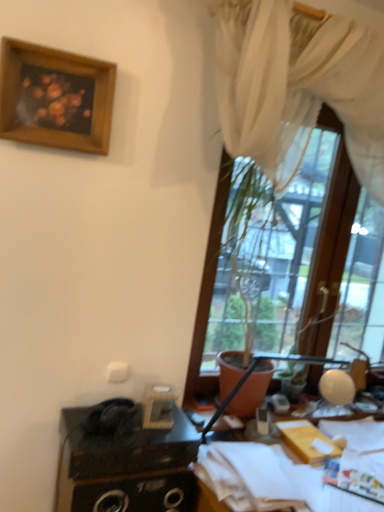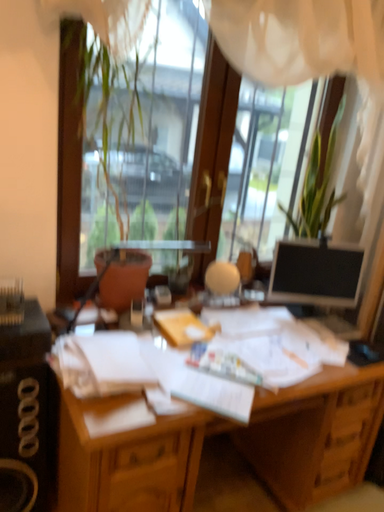
Question: Which way did the camera rotate in the video?

Choices:
 (A) rotated upward
 (B) rotated downward

Answer: (B)